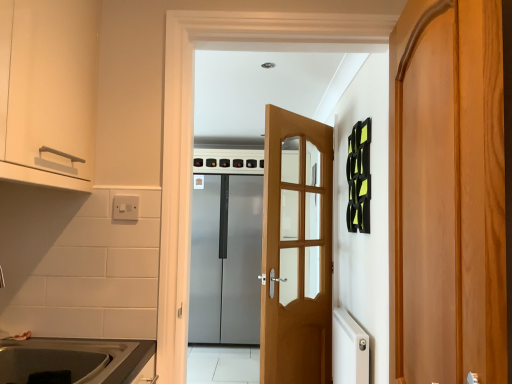
Question: Can you confirm if light brown wooden door at center, which is the 2th door from right to left, is shorter than wooden door at right, the first door from the front?

Choices:
 (A) no
 (B) yes

Answer: (A)

Question: Are light brown wooden door at center, which is the second door from left to right, and wooden door at right, the first door viewed from the right, making contact?

Choices:
 (A) yes
 (B) no

Answer: (B)

Question: Can you confirm if light brown wooden door at center, which is the 2th door from right to left, is taller than wooden door at right, the first door from the front?

Choices:
 (A) yes
 (B) no

Answer: (A)

Question: Can you confirm if light brown wooden door at center, which is the second door from left to right, is thinner than wooden door at right, the first door from the front?

Choices:
 (A) yes
 (B) no

Answer: (A)

Question: Considering the relative positions of light brown wooden door at center, which is the second door from left to right, and wooden door at right, the 3th door in the left-to-right sequence, in the image provided, is light brown wooden door at center, which is the second door from left to right, to the right of wooden door at right, the 3th door in the left-to-right sequence, from the viewer's perspective?

Choices:
 (A) yes
 (B) no

Answer: (B)

Question: Is wooden door at right, which appears as the 3th door when viewed from the back, wider or thinner than matte white cabinet at upper left?

Choices:
 (A) wide
 (B) thin

Answer: (B)

Question: Considering the relative positions of wooden door at right, the first door viewed from the right, and matte white cabinet at upper left in the image provided, is wooden door at right, the first door viewed from the right, to the left or to the right of matte white cabinet at upper left?

Choices:
 (A) right
 (B) left

Answer: (A)

Question: Is point (396, 264) closer or farther from the camera than point (76, 109)?

Choices:
 (A) farther
 (B) closer

Answer: (A)

Question: From the image's perspective, is wooden door at right, which appears as the 3th door when viewed from the back, located above or below matte white cabinet at upper left?

Choices:
 (A) above
 (B) below

Answer: (B)

Question: Looking at their shapes, would you say white ribbed radiator at lower right is wider or thinner than light brown wooden door at center, the second door positioned from the back?

Choices:
 (A) thin
 (B) wide

Answer: (A)

Question: From a real-world perspective, relative to light brown wooden door at center, the second door when ordered from front to back, is white ribbed radiator at lower right vertically above or below?

Choices:
 (A) above
 (B) below

Answer: (B)

Question: Is point (351, 329) closer or farther from the camera than point (312, 228)?

Choices:
 (A) farther
 (B) closer

Answer: (B)

Question: Is white ribbed radiator at lower right to the left or to the right of light brown wooden door at center, the second door when ordered from front to back, in the image?

Choices:
 (A) right
 (B) left

Answer: (A)

Question: Considering their positions, is satin silver refrigerator at center, positioned as the 1th door in left-to-right order, located in front of or behind wooden door at right, the first door viewed from the right?

Choices:
 (A) behind
 (B) front

Answer: (A)

Question: From the image's perspective, is satin silver refrigerator at center, the first door when ordered from back to front, located above or below wooden door at right, the 3th door in the left-to-right sequence?

Choices:
 (A) above
 (B) below

Answer: (B)